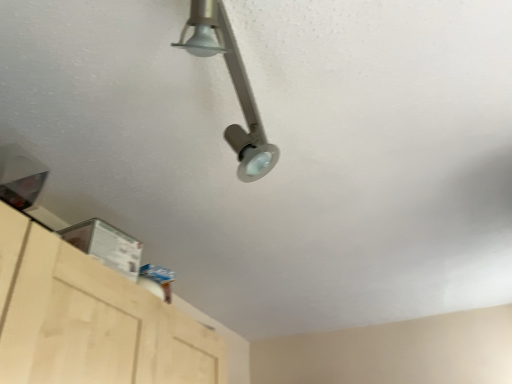
Question: Based on their positions, is satin nickel track light at upper center located to the left or right of light wood cabinet at lower left?

Choices:
 (A) left
 (B) right

Answer: (B)

Question: Based on their sizes in the image, would you say satin nickel track light at upper center is bigger or smaller than light wood cabinet at lower left?

Choices:
 (A) small
 (B) big

Answer: (A)

Question: Is satin nickel track light at upper center taller or shorter than light wood cabinet at lower left?

Choices:
 (A) tall
 (B) short

Answer: (B)

Question: Looking at the image, does light wood cabinet at lower left seem bigger or smaller compared to satin nickel track light at upper center?

Choices:
 (A) big
 (B) small

Answer: (A)

Question: From the image's perspective, is light wood cabinet at lower left positioned above or below satin nickel track light at upper center?

Choices:
 (A) below
 (B) above

Answer: (A)

Question: Is light wood cabinet at lower left taller or shorter than satin nickel track light at upper center?

Choices:
 (A) short
 (B) tall

Answer: (B)

Question: Based on their positions, is light wood cabinet at lower left located to the left or right of satin nickel track light at upper center?

Choices:
 (A) left
 (B) right

Answer: (A)